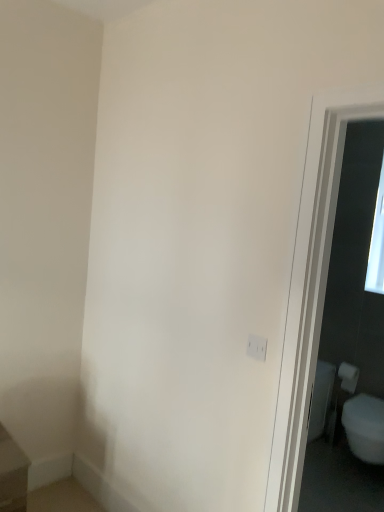
Question: In the image, is white matte electric outlet at center-right positioned in front of or behind white matte toilet paper at right?

Choices:
 (A) behind
 (B) front

Answer: (B)

Question: Is white matte electric outlet at center-right spatially inside white matte toilet paper at right, or outside of it?

Choices:
 (A) outside
 (B) inside

Answer: (A)

Question: In terms of width, does white matte electric outlet at center-right look wider or thinner when compared to white matte toilet paper at right?

Choices:
 (A) wide
 (B) thin

Answer: (B)

Question: Based on their sizes in the image, would you say white matte toilet paper at right is bigger or smaller than white matte electric outlet at center-right?

Choices:
 (A) big
 (B) small

Answer: (A)

Question: Looking at their shapes, would you say white matte toilet paper at right is wider or thinner than white matte electric outlet at center-right?

Choices:
 (A) thin
 (B) wide

Answer: (B)

Question: From the image's perspective, is white matte toilet paper at right positioned above or below white matte electric outlet at center-right?

Choices:
 (A) above
 (B) below

Answer: (B)

Question: Considering the positions of point (342, 377) and point (259, 336), is point (342, 377) closer or farther from the camera than point (259, 336)?

Choices:
 (A) closer
 (B) farther

Answer: (B)